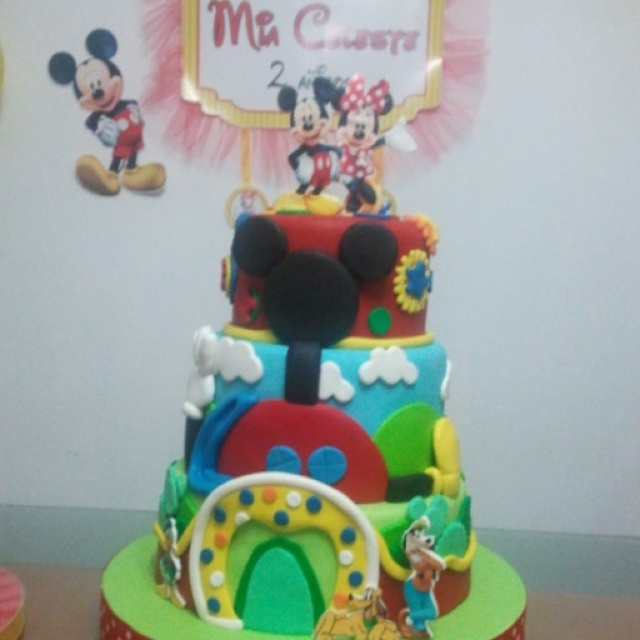
Who is positioned more to the right, matte red plush toy at upper left or matte red minnie mouse at upper center?

matte red minnie mouse at upper center is more to the right.

Is point (96, 108) more distant than point (348, 198)?

Yes, it is.

At what (x,y) coordinates should I click in order to perform the action: click on matte red plush toy at upper left. Please return your answer as a coordinate pair (x, y). The height and width of the screenshot is (640, 640). Looking at the image, I should click on [106, 118].

Where is `matte red plush toy at upper left`? matte red plush toy at upper left is located at coordinates (106, 118).

Is smooth plastic mickey mouse at center above matte red minnie mouse at upper center?

Indeed, smooth plastic mickey mouse at center is positioned over matte red minnie mouse at upper center.

Between smooth plastic mickey mouse at center and matte red minnie mouse at upper center, which one is positioned higher?

Positioned higher is smooth plastic mickey mouse at center.

Which is in front, point (326, 129) or point (362, 161)?

Point (362, 161) is in front.

The image size is (640, 640). I want to click on smooth plastic mickey mouse at center, so click(x=310, y=129).

Does matte red plush toy at upper left lie in front of smooth plastic mickey mouse at center?

No, matte red plush toy at upper left is behind smooth plastic mickey mouse at center.

Does matte red plush toy at upper left have a smaller size compared to smooth plastic mickey mouse at center?

Incorrect, matte red plush toy at upper left is not smaller in size than smooth plastic mickey mouse at center.

Is point (116, 125) positioned in front of point (326, 182)?

No, (116, 125) is further to viewer.

Where is `matte red plush toy at upper left`? This screenshot has height=640, width=640. matte red plush toy at upper left is located at coordinates (106, 118).